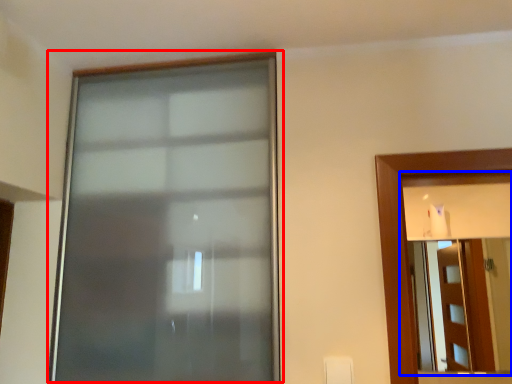
Question: Which object appears closest to the camera in this image, window (highlighted by a red box) or mirror (highlighted by a blue box)?

Choices:
 (A) window
 (B) mirror

Answer: (A)